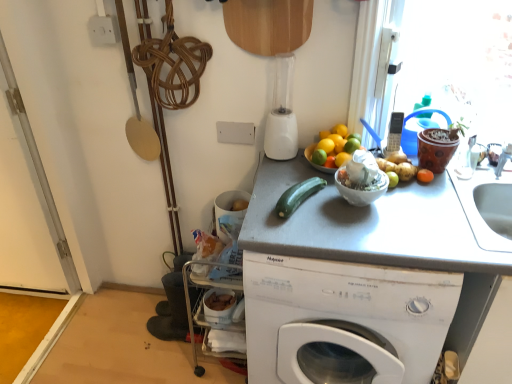
At what (x,y) coordinates should I click in order to perform the action: click on vacant space that is to the left of green matte lime at center, placed as the second lime when sorted from right to left. Please return your answer as a coordinate pair (x, y). This screenshot has height=384, width=512. Looking at the image, I should click on pos(284,177).